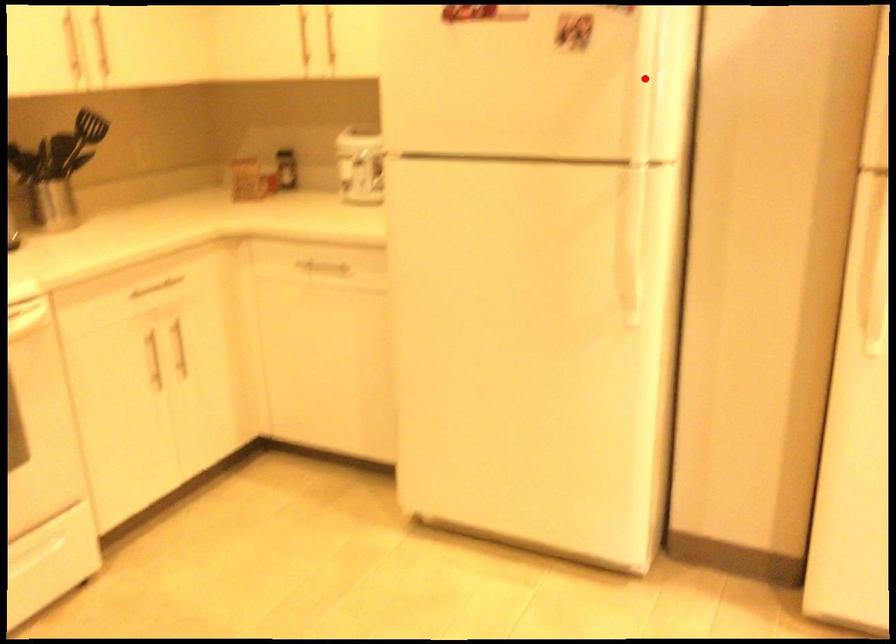
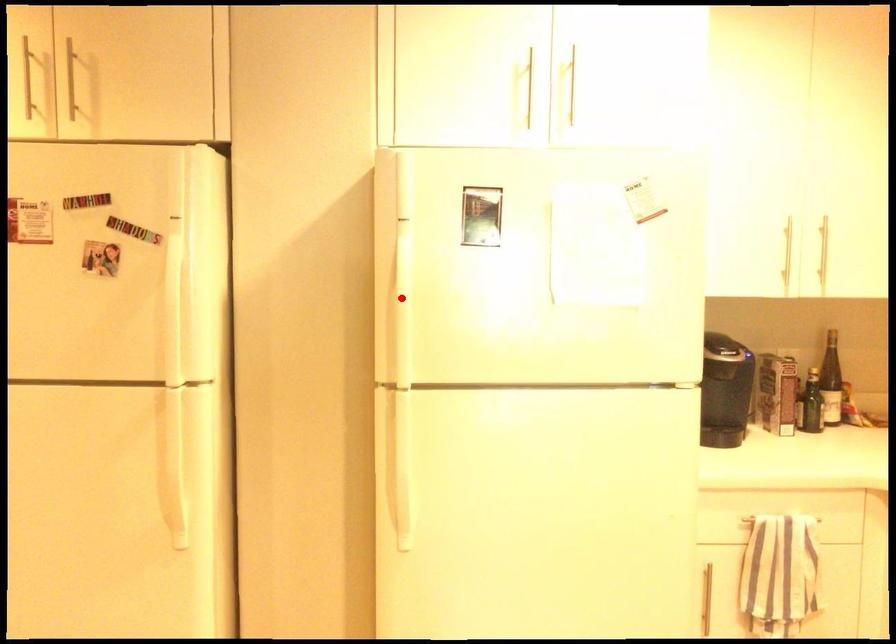
I am providing you with two images of the same scene from different viewpoints. A red point is marked on the first image and another point is marked on the second image. Is the red point in image1 aligned with the point shown in image2?

No